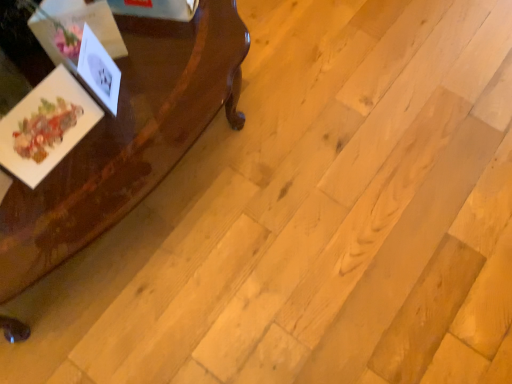
You are a GUI agent. You are given a task and a screenshot of the screen. Output one action in this format:
    pyautogui.click(x=<x>, y=<y>)
    Task: Click on the vacant region in front of matte paper postcard at left, the 2th postcard in the right-to-left sequence
    This screenshot has width=512, height=384.
    Given the screenshot: What is the action you would take?
    pyautogui.click(x=52, y=210)